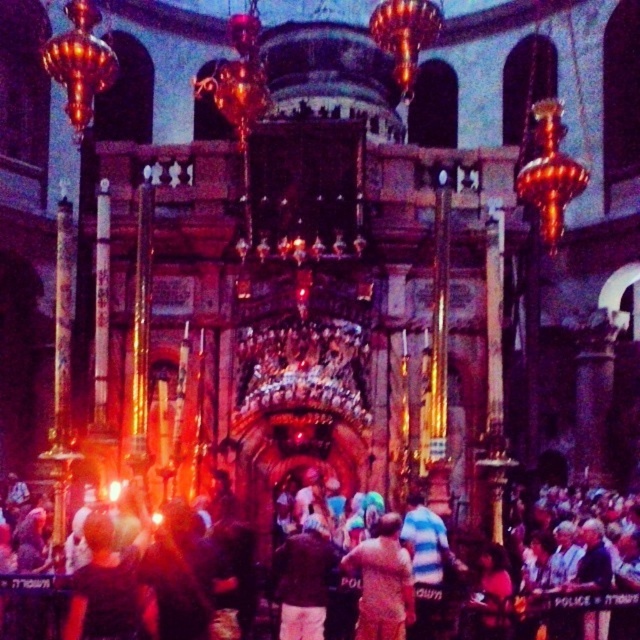
Question: Can you confirm if brown fabric shirt at center is thinner than light brown leather jacket at center?

Choices:
 (A) yes
 (B) no

Answer: (B)

Question: Which object appears closest to the camera in this image?

Choices:
 (A) brown fabric shirt at center
 (B) light brown leather jacket at center

Answer: (A)

Question: Can you confirm if brown fabric shirt at center is bigger than light brown leather jacket at center?

Choices:
 (A) no
 (B) yes

Answer: (A)

Question: Is brown fabric shirt at center behind light brown leather jacket at center?

Choices:
 (A) no
 (B) yes

Answer: (A)

Question: Which point is closer to the camera?

Choices:
 (A) light brown leather jacket at center
 (B) brown fabric shirt at center

Answer: (B)

Question: Which point is farther from the camera taking this photo?

Choices:
 (A) (396, 634)
 (B) (333, 554)

Answer: (B)